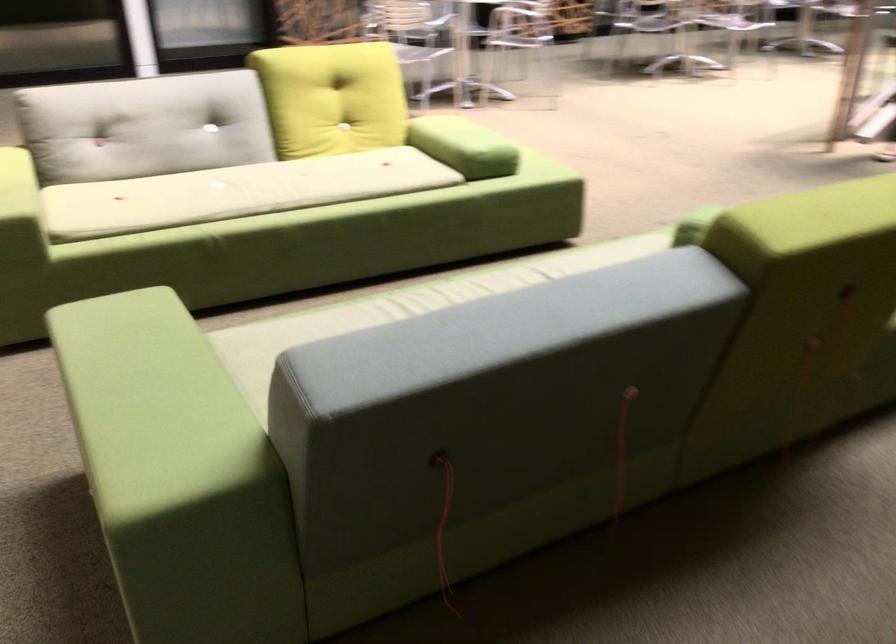
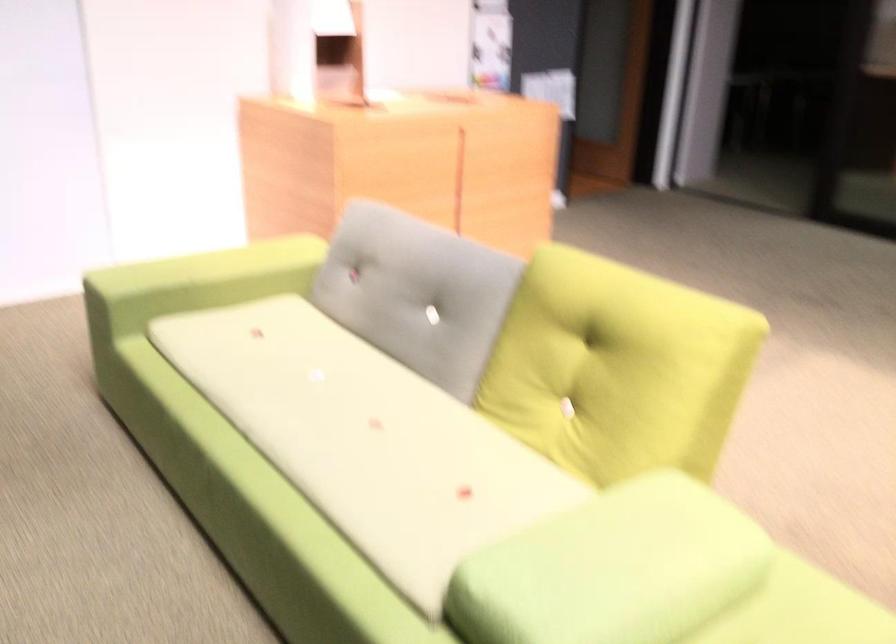
Where in the second image is the point corresponding to pixel 359 84 from the first image?

(616, 368)